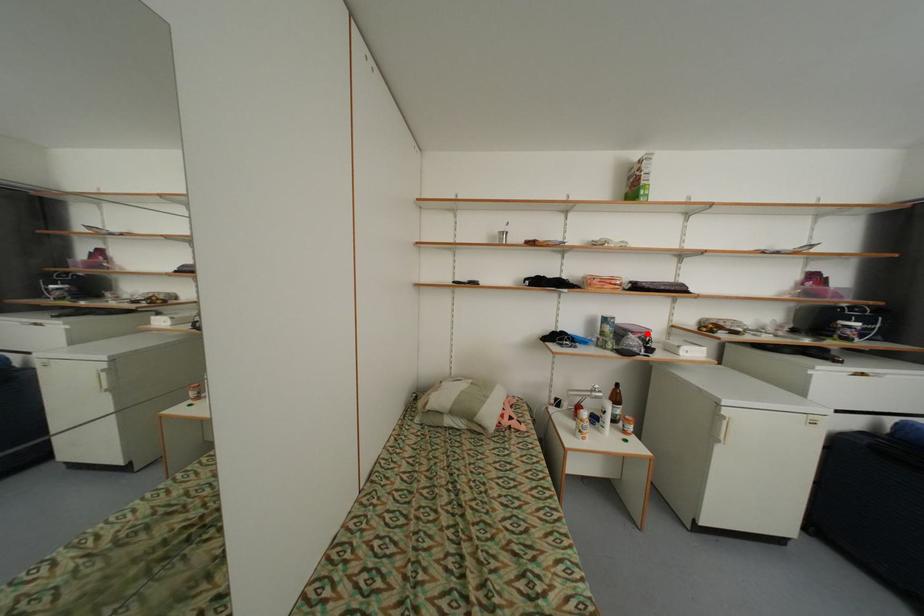
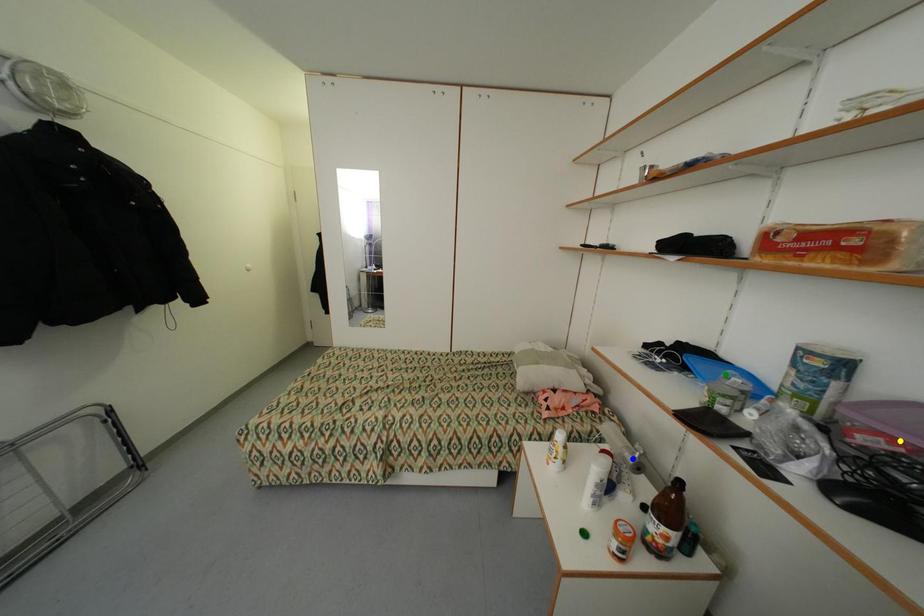
Question: I am providing you with two images of the same scene from different viewpoints. A red point is marked on the first image. You are given multiple points on the second image. Which point in image 2 represents the same 3d spot as the red point in image 1?

Choices:
 (A) blue point
 (B) green point
 (C) yellow point

Answer: (C)